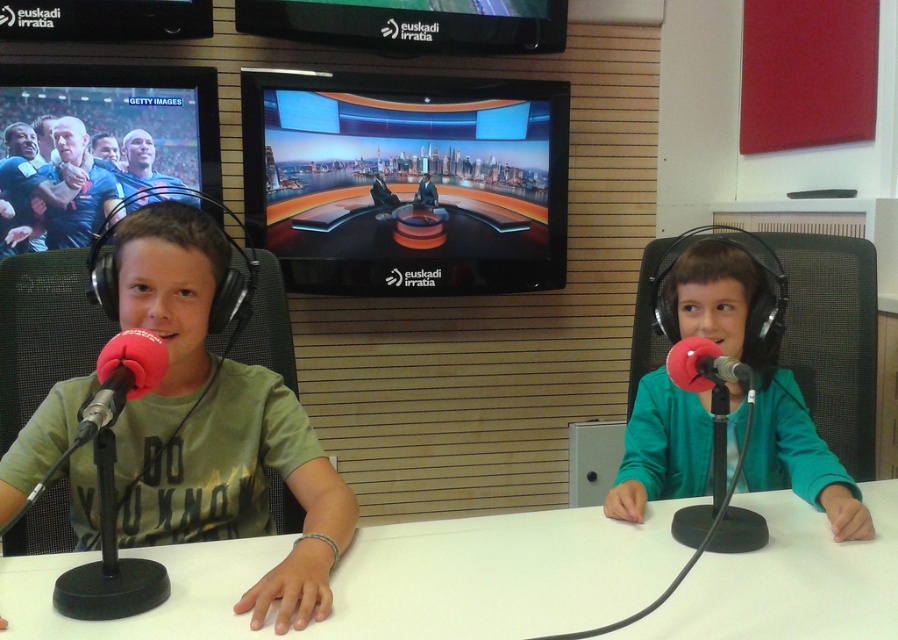
You are a sound engineer in a studio. You need to place a microphone stand between the matte green shirt at left and the green matte jacket at right. The stand requires at least 24 inches of space to fit. Can you fit it between them?

The matte green shirt at left and green matte jacket at right are 28.00 inches apart, so yes, the microphone stand can fit between them since 28 inches is more than the required 24 inches.

You are standing in front of the studio setup. The camera is positioned to capture the scene. Where is the matte green shirt at left located in the 2D coordinates of the image?

The matte green shirt at left is located at the 2D coordinates of point [216,426].